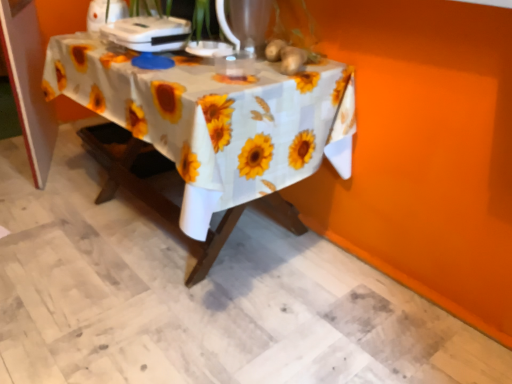
Locate an element on the screen. The width and height of the screenshot is (512, 384). free spot in front of white fabric tablecloth at center is located at coordinates (165, 322).